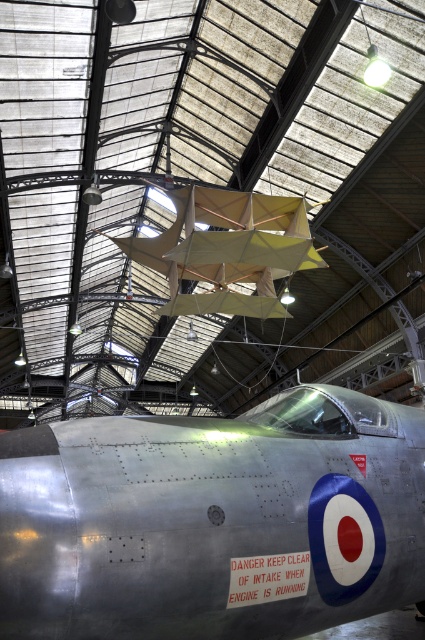
Question: Which object appears closest to the camera in this image?

Choices:
 (A) silver metallic airplane at center
 (B) matte yellow paper airplane at center

Answer: (A)

Question: Does silver metallic airplane at center have a smaller size compared to matte yellow paper airplane at center?

Choices:
 (A) no
 (B) yes

Answer: (B)

Question: Does silver metallic airplane at center have a smaller size compared to matte yellow paper airplane at center?

Choices:
 (A) yes
 (B) no

Answer: (A)

Question: Among these points, which one is nearest to the camera?

Choices:
 (A) (112, 432)
 (B) (244, 216)

Answer: (A)

Question: Is silver metallic airplane at center positioned in front of matte yellow paper airplane at center?

Choices:
 (A) no
 (B) yes

Answer: (B)

Question: Which object is farther from the camera taking this photo?

Choices:
 (A) matte yellow paper airplane at center
 (B) silver metallic airplane at center

Answer: (A)